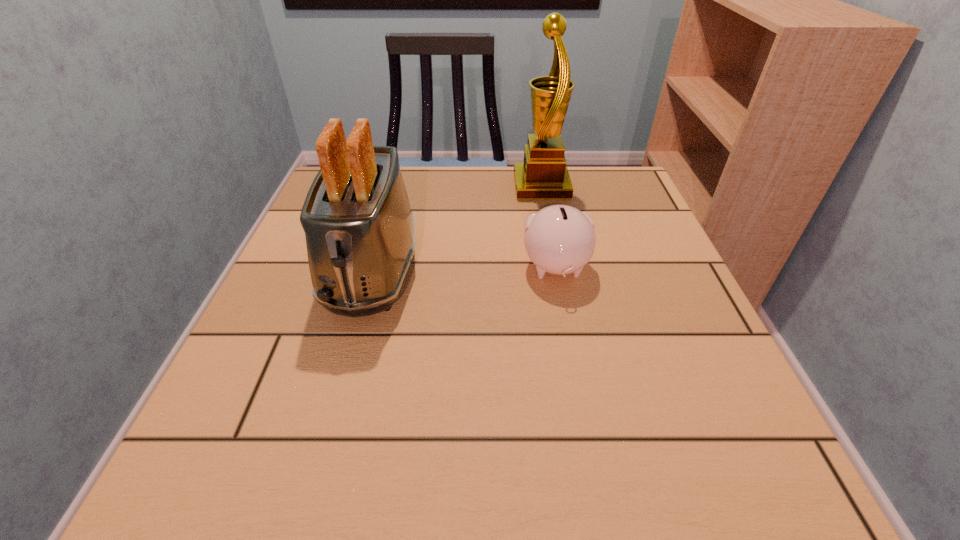
The image size is (960, 540). What are the coordinates of `empty space that is in between the toaster and the farthest object` in the screenshot? It's located at (457, 228).

The width and height of the screenshot is (960, 540). I want to click on free space between the leftmost object and the piggy bank, so point(464,269).

Locate an element on the screen. This screenshot has height=540, width=960. vacant space in between the leftmost object and the piggy bank is located at coordinates (464, 269).

Where is `free space between the leftmost object and the award`? The width and height of the screenshot is (960, 540). free space between the leftmost object and the award is located at coordinates (457, 228).

The width and height of the screenshot is (960, 540). Find the location of `object that ranks as the second closest to the shortest object`. object that ranks as the second closest to the shortest object is located at coordinates (359, 228).

Choose which object is the nearest neighbor to the shortest object. Please provide its 2D coordinates. Your answer should be formatted as a tuple, i.e. [(x, y)], where the tuple contains the x and y coordinates of a point satisfying the conditions above.

[(543, 175)]

This screenshot has width=960, height=540. I want to click on vacant area in the image that satisfies the following two spatial constraints: 1. on the front-facing side of the tallest object; 2. on the side of the leftmost object with the control lever, so click(x=558, y=269).

Find the location of `vacant point that satisfies the following two spatial constraints: 1. on the front-facing side of the tallest object; 2. on the side of the leftmost object with the control lever`. vacant point that satisfies the following two spatial constraints: 1. on the front-facing side of the tallest object; 2. on the side of the leftmost object with the control lever is located at coordinates (558, 269).

Image resolution: width=960 pixels, height=540 pixels. I want to click on free space that satisfies the following two spatial constraints: 1. on the front-facing side of the award; 2. on the front side of the shortest object, so click(x=558, y=268).

At what (x,y) coordinates should I click in order to perform the action: click on vacant region that satisfies the following two spatial constraints: 1. on the front-facing side of the farthest object; 2. on the front side of the piggy bank. Please return your answer as a coordinate pair (x, y). Looking at the image, I should click on (558, 268).